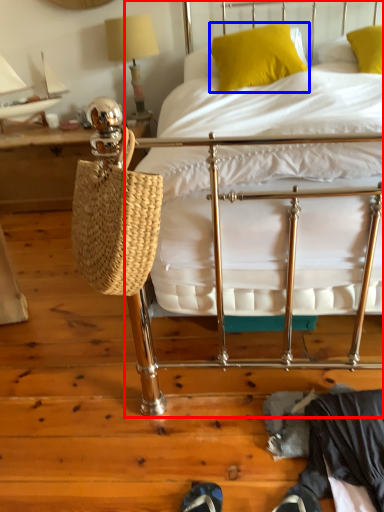
Question: Which point is closer to the camera, bed (highlighted by a red box) or pillow (highlighted by a blue box)?

Choices:
 (A) bed
 (B) pillow

Answer: (A)